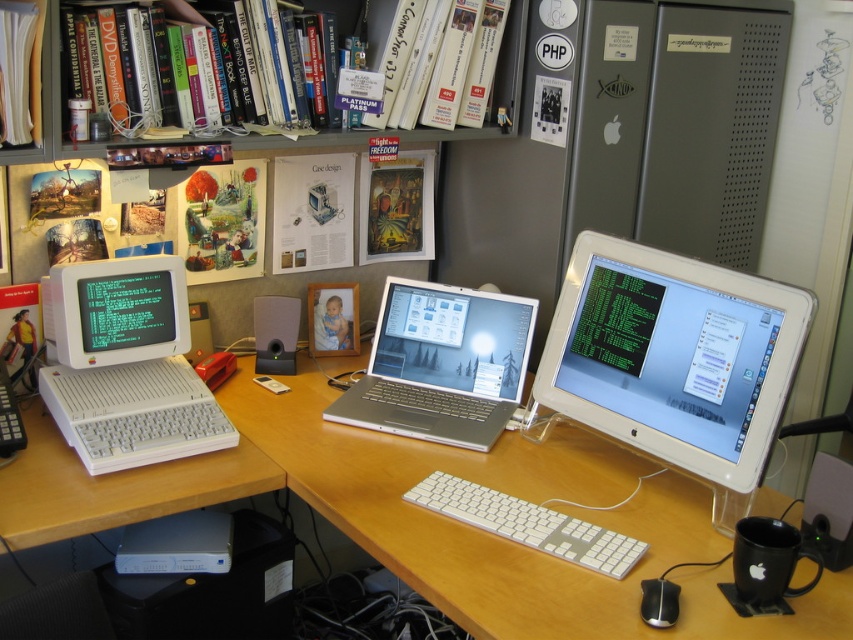
Question: Which point is farther from the camera taking this photo?

Choices:
 (A) (665, 602)
 (B) (608, 561)
 (C) (508, 616)

Answer: (B)

Question: Can you confirm if wooden at center is bigger than white plastic keyboard at center?

Choices:
 (A) no
 (B) yes

Answer: (B)

Question: Where is white glossy monitor at center right located in relation to silver metallic laptop at center in the image?

Choices:
 (A) below
 (B) above

Answer: (B)

Question: Which object is positioned closest to the white plastic computer at left?

Choices:
 (A) black plastic mouse at lower right
 (B) white plastic keyboard at center

Answer: (B)

Question: Does white plastic computer at left have a greater width compared to silver metallic laptop at center?

Choices:
 (A) no
 (B) yes

Answer: (A)

Question: Which object appears closest to the camera in this image?

Choices:
 (A) white plastic computer at left
 (B) white plastic books at upper left
 (C) white plastic keyboard at center

Answer: (C)